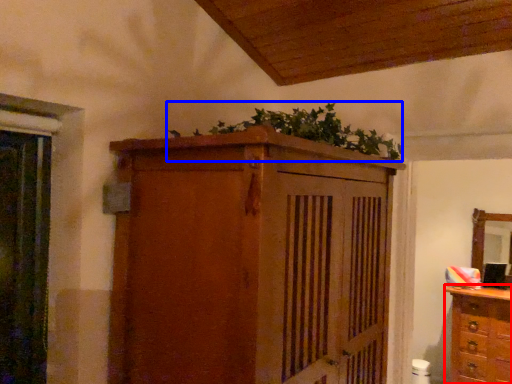
Question: Among these objects, which one is nearest to the camera, chest of drawers (highlighted by a red box) or plant (highlighted by a blue box)?

Choices:
 (A) chest of drawers
 (B) plant

Answer: (B)